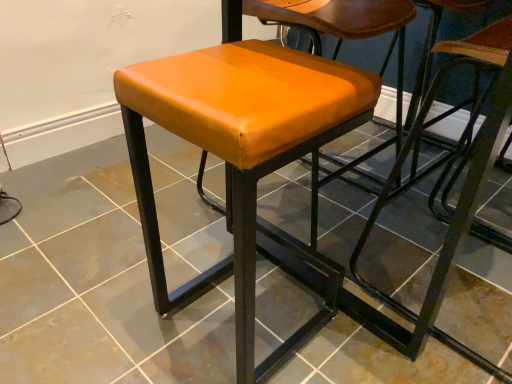
The height and width of the screenshot is (384, 512). What are the coordinates of `spots to the right of orange leather stool at center` in the screenshot? It's located at (368, 329).